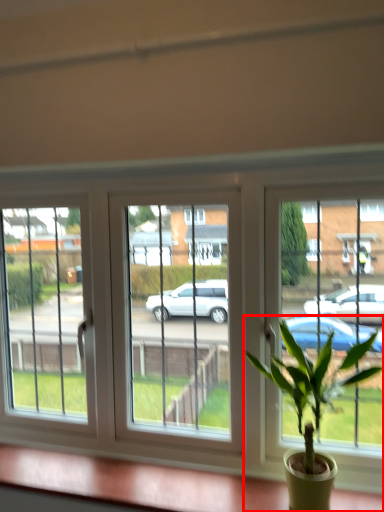
Question: From the image's perspective, what is the correct spatial positioning of houseplant (annotated by the red box) in reference to window sill?

Choices:
 (A) above
 (B) below

Answer: (A)